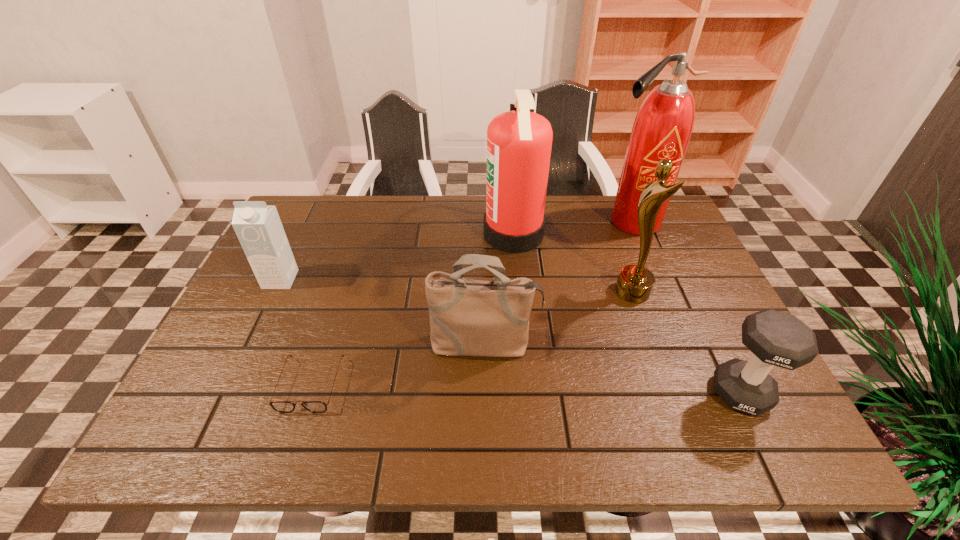
The width and height of the screenshot is (960, 540). Identify the location of sunglasses present at the near edge. (280, 406).

This screenshot has height=540, width=960. I want to click on object that is at the left edge, so [x=258, y=227].

What are the coordinates of `fire extinguisher that is at the right edge` in the screenshot? It's located at (662, 128).

Find the location of a particular element. Image resolution: width=960 pixels, height=540 pixels. dumbbell that is at the right edge is located at coordinates (776, 338).

Locate an element on the screen. The image size is (960, 540). object present at the far right corner is located at coordinates click(662, 128).

In order to click on object located in the near right corner section of the desktop in this screenshot , I will do `click(776, 338)`.

In the image, there is a desktop. Where is `vacant space at the far edge`? The image size is (960, 540). vacant space at the far edge is located at coordinates (562, 208).

At what (x,y) coordinates should I click in order to perform the action: click on free location at the near edge. Please return your answer as a coordinate pair (x, y). Looking at the image, I should click on (322, 428).

Where is `vacant area at the right edge`? Image resolution: width=960 pixels, height=540 pixels. vacant area at the right edge is located at coordinates (738, 357).

This screenshot has width=960, height=540. I want to click on blank space at the far left corner of the desktop, so click(x=330, y=218).